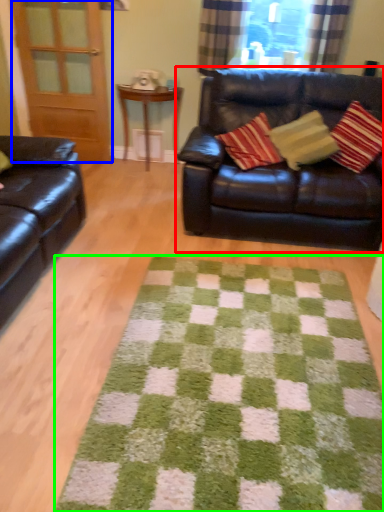
Question: Based on their relative distances, which object is farther from studio couch (highlighted by a red box)? Choose from screen door (highlighted by a blue box) and doormat (highlighted by a green box).

Choices:
 (A) screen door
 (B) doormat

Answer: (A)